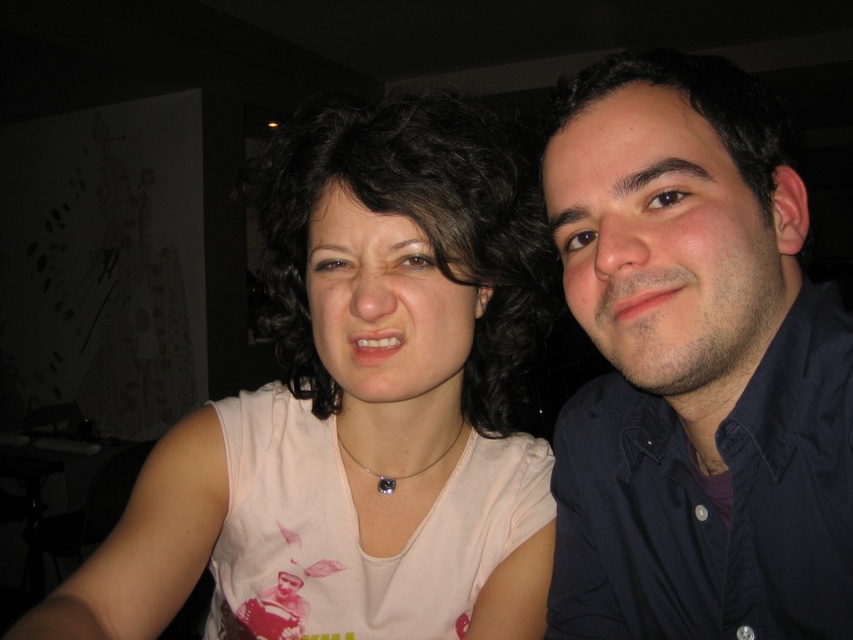
Can you confirm if pink fabric shirt at center is positioned to the left of dark blue shirt at right?

Yes, pink fabric shirt at center is to the left of dark blue shirt at right.

Which is in front, point (312, 161) or point (698, 632)?

Point (312, 161)

This screenshot has height=640, width=853. I want to click on pink fabric shirt at center, so click(357, 410).